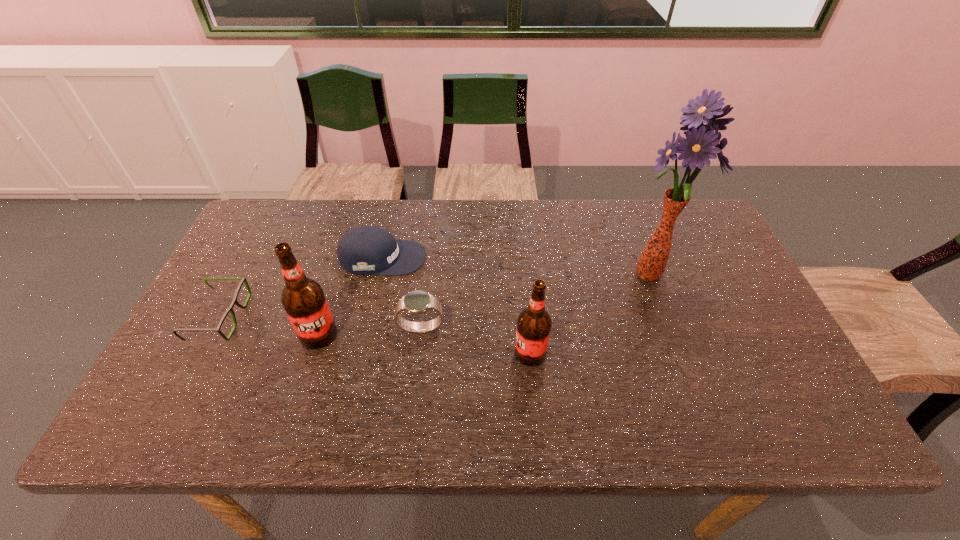
The image size is (960, 540). Identify the location of the taller root beer. tap(303, 299).

The image size is (960, 540). Identify the location of the fifth shortest object. (303, 299).

I want to click on the second object from right to left, so click(x=534, y=323).

Where is `the third tallest object`? This screenshot has width=960, height=540. the third tallest object is located at coordinates coord(534,323).

Locate an element on the screen. The width and height of the screenshot is (960, 540). baseball cap is located at coordinates (364, 250).

At what (x,y) coordinates should I click in order to perform the action: click on watch. Please return your answer as a coordinate pair (x, y). Looking at the image, I should click on (415, 302).

The image size is (960, 540). Find the location of `the tallest object`. the tallest object is located at coordinates (700, 117).

Locate an element on the screen. flower arrangement is located at coordinates (700, 117).

Locate an element on the screen. spectacles is located at coordinates (243, 280).

Where is `the shortest object`? The width and height of the screenshot is (960, 540). the shortest object is located at coordinates (243, 280).